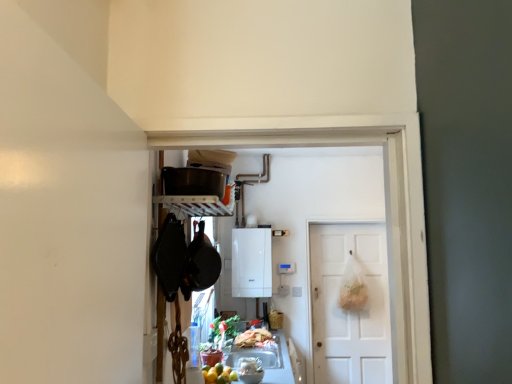
Question: Can you confirm if white matte door at center is thinner than white glossy boiler at center?

Choices:
 (A) no
 (B) yes

Answer: (B)

Question: Does white matte door at center turn towards white glossy boiler at center?

Choices:
 (A) no
 (B) yes

Answer: (A)

Question: From the image's perspective, does white matte door at center appear lower than white glossy boiler at center?

Choices:
 (A) yes
 (B) no

Answer: (A)

Question: Is white matte door at center closer to the viewer compared to white glossy boiler at center?

Choices:
 (A) no
 (B) yes

Answer: (A)

Question: Is white glossy boiler at center completely or partially inside white matte door at center?

Choices:
 (A) yes
 (B) no

Answer: (B)

Question: From a real-world perspective, does white matte door at center stand above white glossy boiler at center?

Choices:
 (A) yes
 (B) no

Answer: (B)

Question: Considering the relative sizes of white glossy boiler at center and matte black pot at upper center in the image provided, is white glossy boiler at center bigger than matte black pot at upper center?

Choices:
 (A) no
 (B) yes

Answer: (B)

Question: From a real-world perspective, is white glossy boiler at center beneath matte black pot at upper center?

Choices:
 (A) yes
 (B) no

Answer: (A)

Question: Could matte black pot at upper center be considered to be inside white glossy boiler at center?

Choices:
 (A) no
 (B) yes

Answer: (A)

Question: Does white glossy boiler at center turn towards matte black pot at upper center?

Choices:
 (A) yes
 (B) no

Answer: (A)

Question: Can you confirm if white glossy boiler at center is wider than matte black pot at upper center?

Choices:
 (A) no
 (B) yes

Answer: (B)

Question: Does white glossy boiler at center appear on the left side of matte black pot at upper center?

Choices:
 (A) yes
 (B) no

Answer: (B)

Question: Can you confirm if shiny plastic bag of food at lower center is shorter than white matte door at center?

Choices:
 (A) no
 (B) yes

Answer: (B)